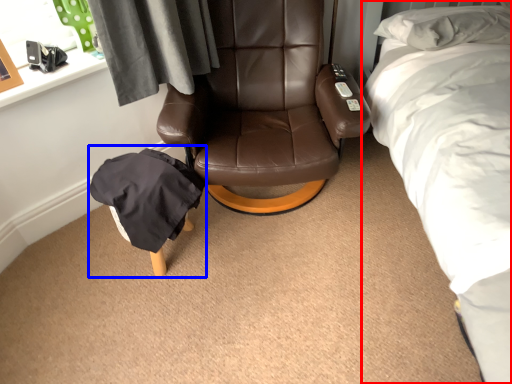
Question: Which point is further to the camera, bed (highlighted by a red box) or bean bag chair (highlighted by a blue box)?

Choices:
 (A) bed
 (B) bean bag chair

Answer: (B)